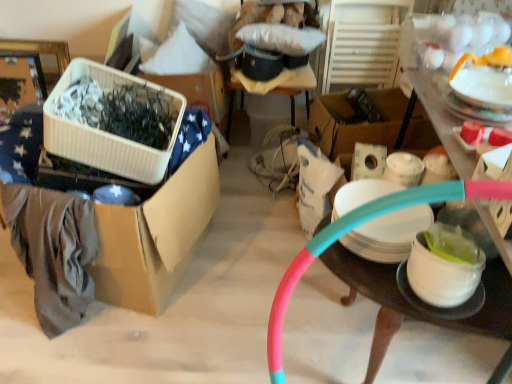
Question: In terms of width, does pink rubber hoop at center, positioned as the 1th storage box in right-to-left order, look wider or thinner when compared to white glossy bowl at lower right, the second tableware viewed from the right?

Choices:
 (A) thin
 (B) wide

Answer: (B)

Question: From a real-world perspective, is pink rubber hoop at center, positioned as the 1th storage box in right-to-left order, physically located above or below white glossy bowl at lower right, placed as the second tableware when sorted from left to right?

Choices:
 (A) above
 (B) below

Answer: (A)

Question: Which object is positioned closest to the pink rubber hoop at center, the 4th storage box positioned from the left?

Choices:
 (A) white matte plate at right, acting as the third tableware starting from the right
 (B) cardboard box at left, arranged as the first storage box when viewed from the left
 (C) white glossy teapot at upper right, marked as the 1th tableware in a top-to-bottom arrangement
 (D) pink rubber hose at right
 (E) white glossy bowl at lower right, which is the 1th tableware from bottom to top

Answer: (E)

Question: Which is nearer to the pink rubber hoop at center, the 4th storage box positioned from the left?

Choices:
 (A) white glossy teapot at upper right, marked as the 1th tableware in a top-to-bottom arrangement
 (B) cardboard box at left, arranged as the first storage box when viewed from the left
 (C) white plastic storage box at upper center, arranged as the second storage box when viewed from the right
 (D) white ribbed plastic container at left, which is the third storage box in right-to-left order
 (E) white matte plate at right, acting as the third tableware starting from the right

Answer: (E)